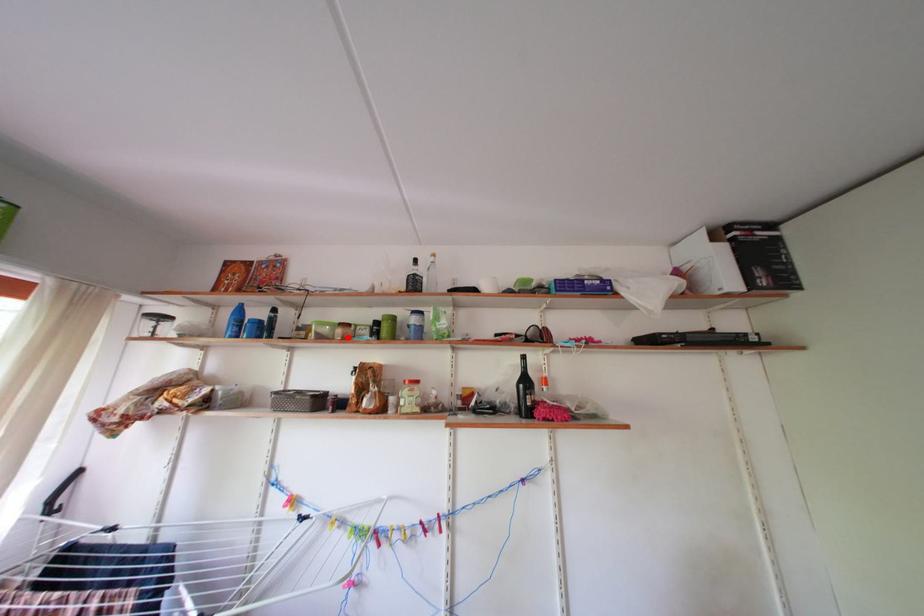
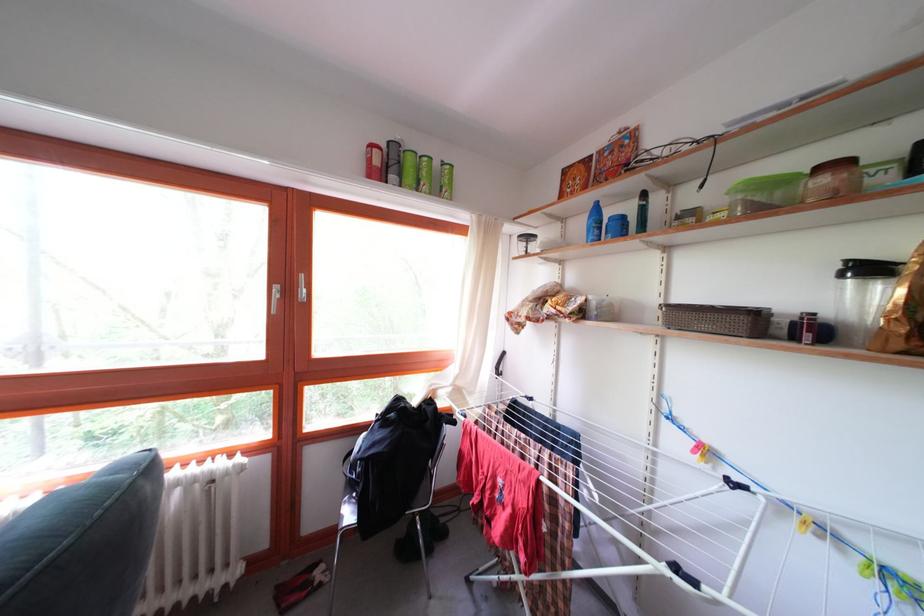
The point at the highlighted location is marked in the first image. Where is the corresponding point in the second image?

(832, 187)